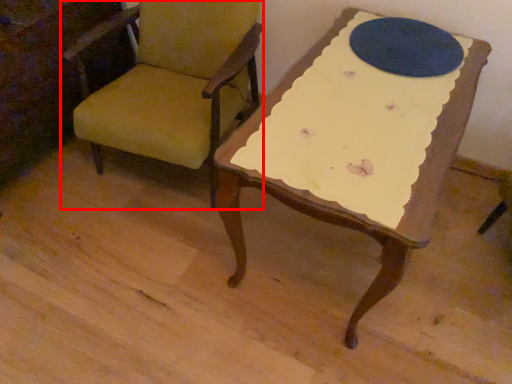
Question: From the image's perspective, what is the correct spatial positioning of chair (annotated by the red box) in reference to oval?

Choices:
 (A) above
 (B) below

Answer: (B)